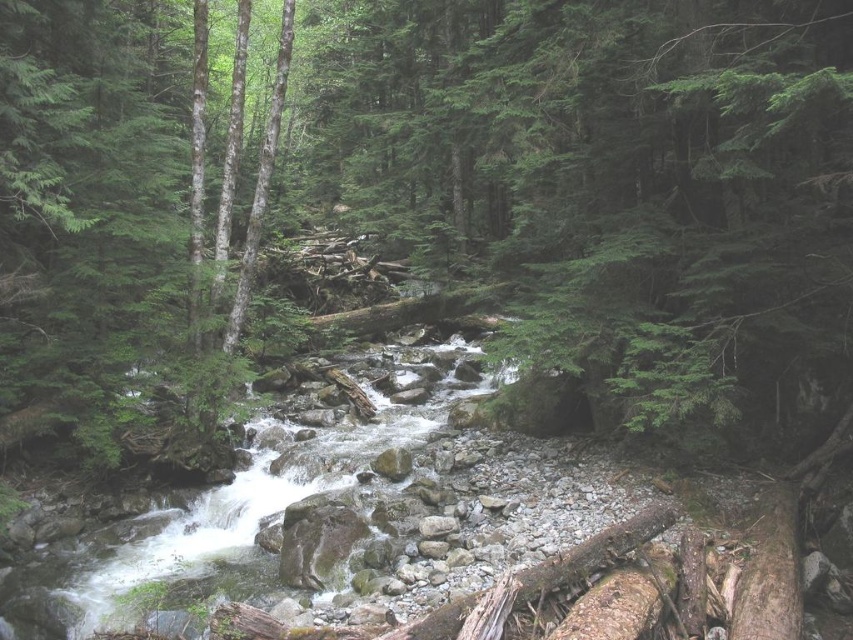
Does green matte tree at center have a greater width compared to white frothy water at center?

In fact, green matte tree at center might be narrower than white frothy water at center.

Is green matte tree at center further to the viewer compared to white frothy water at center?

Yes, green matte tree at center is further from the viewer.

I want to click on green matte tree at center, so click(x=86, y=211).

Locate an element on the screen. green matte tree at center is located at coordinates (86, 211).